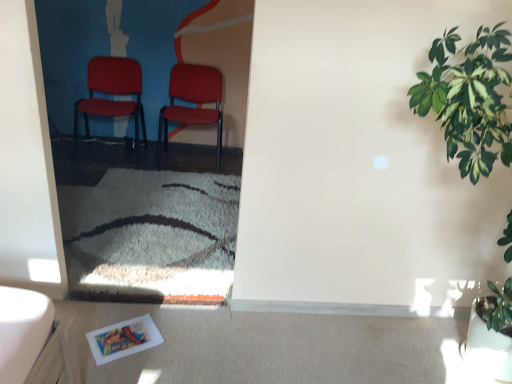
Question: Would you say green leafy plant at right is to the left or to the right of matte red chair at center, marked as the 1th chair in a right-to-left arrangement, in the picture?

Choices:
 (A) left
 (B) right

Answer: (B)

Question: Considering the positions of green leafy plant at right and matte red chair at center, which is the second chair in left-to-right order, in the image, is green leafy plant at right wider or thinner than matte red chair at center, which is the second chair in left-to-right order,?

Choices:
 (A) thin
 (B) wide

Answer: (B)

Question: Estimate the real-world distances between objects in this image. Which object is closer to the green leafy plant at right?

Choices:
 (A) matte red chair at center, which is the second chair in left-to-right order
 (B) matte plastic chair at center, which ranks as the first chair in left-to-right order

Answer: (A)

Question: Which object is the farthest from the green leafy plant at right?

Choices:
 (A) matte plastic chair at center, which ranks as the first chair in left-to-right order
 (B) matte red chair at center, marked as the 1th chair in a right-to-left arrangement

Answer: (A)